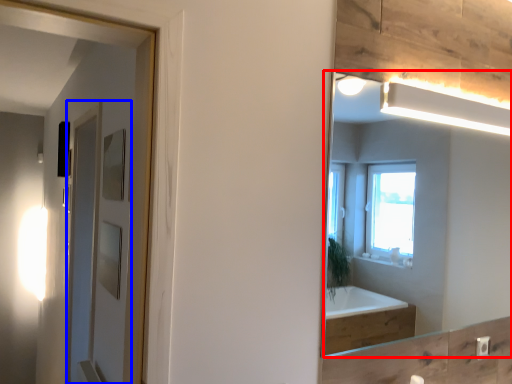
Question: Which point is further to the camera, mirror (highlighted by a red box) or screen door (highlighted by a blue box)?

Choices:
 (A) mirror
 (B) screen door

Answer: (B)